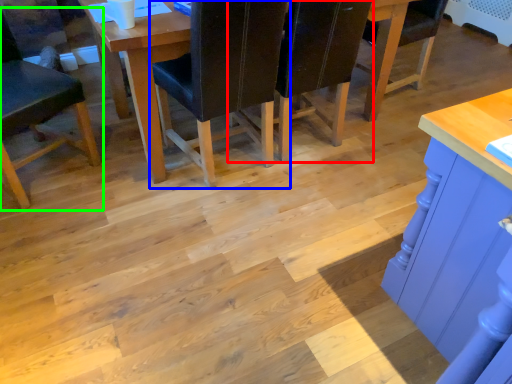
Question: Estimate the real-world distances between objects in this image. Which object is farther from chair (highlighted by a red box), chair (highlighted by a blue box) or chair (highlighted by a green box)?

Choices:
 (A) chair
 (B) chair

Answer: (B)